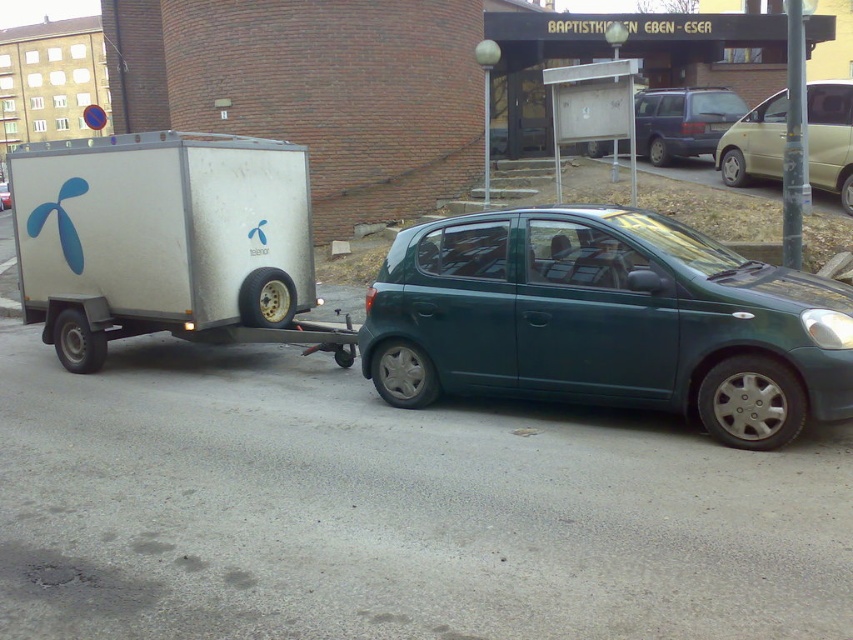
Question: Is green matte car at center to the left of metallic gold minivan at right from the viewer's perspective?

Choices:
 (A) no
 (B) yes

Answer: (B)

Question: Is green matte car at center bigger than silver metallic trailer at left?

Choices:
 (A) yes
 (B) no

Answer: (A)

Question: Among these points, which one is nearest to the camera?

Choices:
 (A) (676, 108)
 (B) (4, 205)
 (C) (57, 236)

Answer: (C)

Question: Does silver metallic trailer at left have a smaller size compared to green matte hatchback at center?

Choices:
 (A) no
 (B) yes

Answer: (B)

Question: Which point is farther from the camera taking this photo?

Choices:
 (A) (730, 141)
 (B) (4, 188)
 (C) (705, 113)

Answer: (B)

Question: Which object is positioned closest to the green matte hatchback at center?

Choices:
 (A) green matte car at center
 (B) silver metallic trailer at left

Answer: (A)